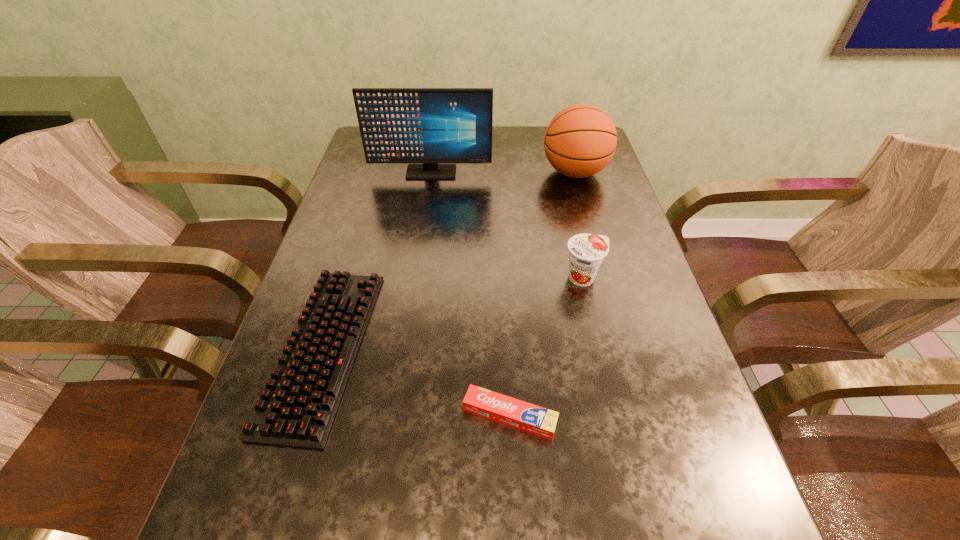
Where is `empty location between the toothpaste and the computer keyboard`? The image size is (960, 540). empty location between the toothpaste and the computer keyboard is located at coordinates (417, 382).

Locate an element on the screen. The width and height of the screenshot is (960, 540). free area in between the computer keyboard and the yogurt is located at coordinates (453, 313).

The width and height of the screenshot is (960, 540). Identify the location of vacant space that is in between the third shortest object and the computer keyboard. (453, 313).

Find the location of a particular element. free area in between the computer keyboard and the toothpaste is located at coordinates 417,382.

I want to click on vacant region between the computer monitor and the computer keyboard, so click(377, 260).

The height and width of the screenshot is (540, 960). Find the location of `vacant region between the yogurt and the tallest object`. vacant region between the yogurt and the tallest object is located at coordinates (507, 225).

Where is `vacant space that's between the second tallest object and the toothpaste`? The image size is (960, 540). vacant space that's between the second tallest object and the toothpaste is located at coordinates (542, 294).

Where is `free space between the tallest object and the computer keyboard`? This screenshot has width=960, height=540. free space between the tallest object and the computer keyboard is located at coordinates (377, 260).

Image resolution: width=960 pixels, height=540 pixels. In order to click on unoccupied area between the computer keyboard and the computer monitor in this screenshot , I will do `click(377, 260)`.

Choose which object is the third nearest neighbor to the tallest object. Please provide its 2D coordinates. Your answer should be formatted as a tuple, i.e. [(x, y)], where the tuple contains the x and y coordinates of a point satisfying the conditions above.

[(297, 407)]